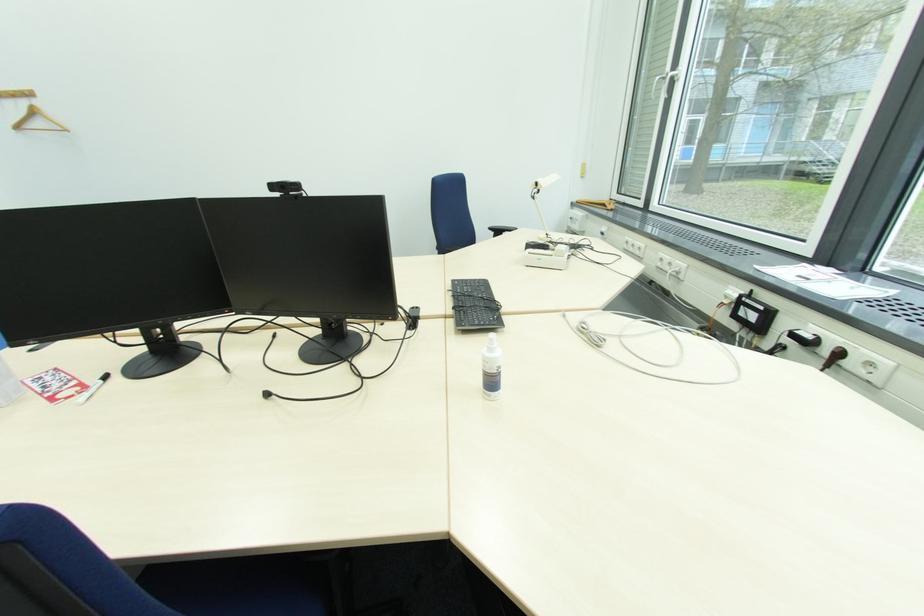
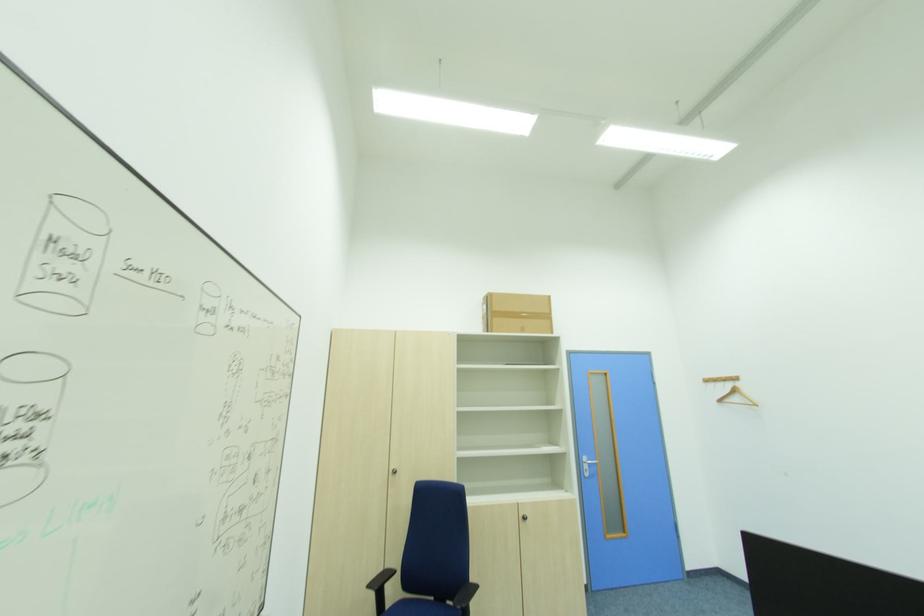
From the picture: The images are taken continuously from a first-person perspective. In which direction is your viewpoint rotating?

The rotation direction of the camera is left-up.